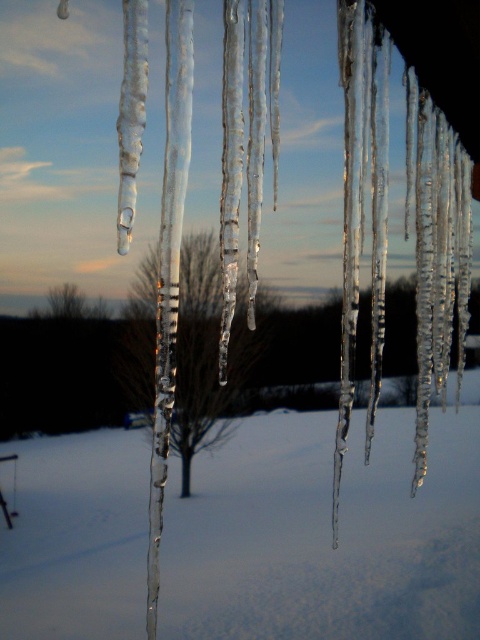
Does transparent ice icicles at center appear over bare branches at center?

Incorrect, transparent ice icicles at center is not positioned above bare branches at center.

This screenshot has height=640, width=480. What are the coordinates of `transparent ice icicles at center` in the screenshot? It's located at (326, 532).

Where is `transparent ice icicles at center`? The height and width of the screenshot is (640, 480). transparent ice icicles at center is located at coordinates (326, 532).